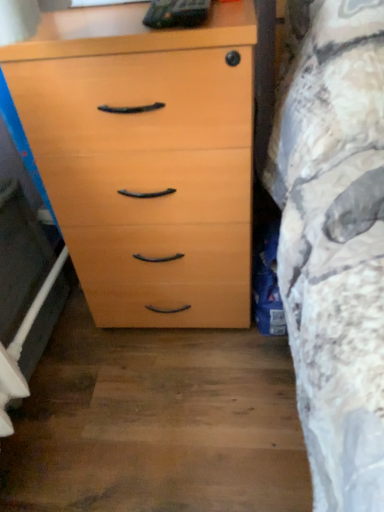
Measure the distance between point (193, 219) and camera.

33.98 inches.

The width and height of the screenshot is (384, 512). What do you see at coordinates (146, 159) in the screenshot?
I see `light wood/finish chest of drawers at center` at bounding box center [146, 159].

Locate an element on the screen. This screenshot has height=512, width=384. light wood/finish chest of drawers at center is located at coordinates (146, 159).

In order to click on light wood/finish chest of drawers at center in this screenshot , I will do `click(146, 159)`.